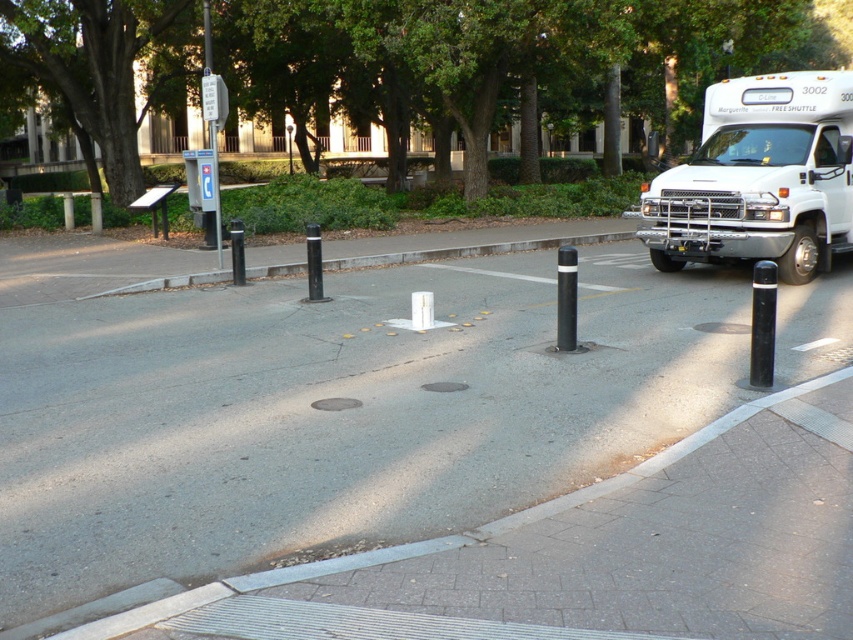
Question: Based on their relative distances, which object is farther from the black metal pole at center?

Choices:
 (A) white plastic sign post at upper center
 (B) white concrete curb at center

Answer: (A)

Question: Which object is closer to the camera taking this photo?

Choices:
 (A) black metal pole at center
 (B) white concrete curb at center
 (C) black rubber pole at right

Answer: (C)

Question: Is gray asphalt at center smaller than black metal pole at center?

Choices:
 (A) yes
 (B) no

Answer: (B)

Question: Does white concrete curb at center have a greater width compared to white plastic sign post at upper center?

Choices:
 (A) yes
 (B) no

Answer: (A)

Question: Is white matte shuttle bus at upper right smaller than white plastic sign post at upper center?

Choices:
 (A) no
 (B) yes

Answer: (A)

Question: Which object is farther from the camera taking this photo?

Choices:
 (A) black polished bollard at center
 (B) white concrete curb at center

Answer: (B)